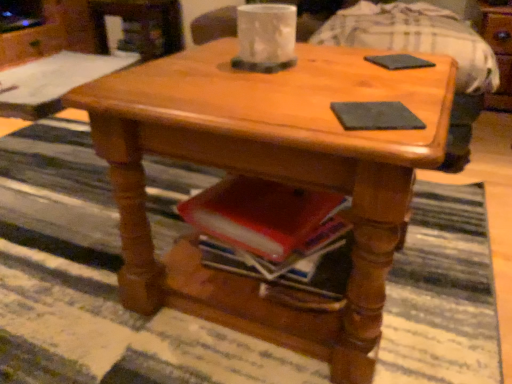
Find the location of a particular element. This screenshot has width=512, height=384. free spot in front of black matte pad at upper right, placed as the 1th pad when sorted from top to bottom is located at coordinates (401, 81).